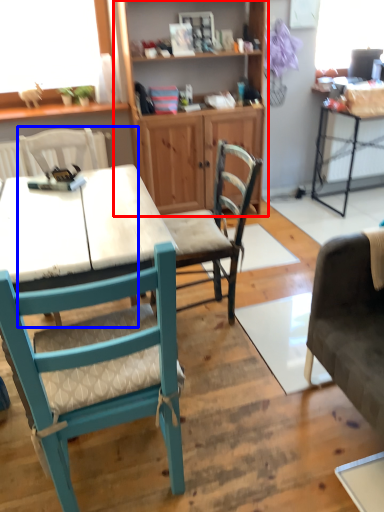
Question: Which object appears farthest to the camera in this image, cabinetry (highlighted by a red box) or chair (highlighted by a blue box)?

Choices:
 (A) cabinetry
 (B) chair

Answer: (A)